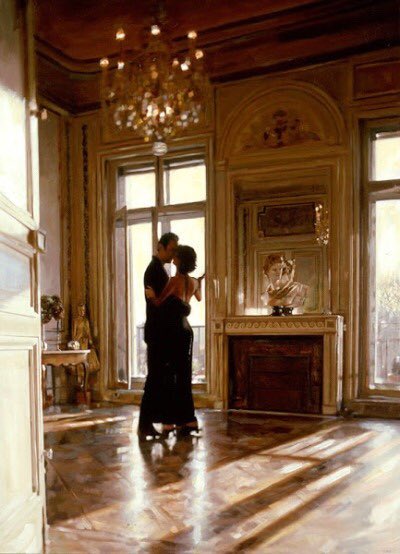
Find the location of `windows`. windows is located at coordinates coord(132,259), coord(393,287).